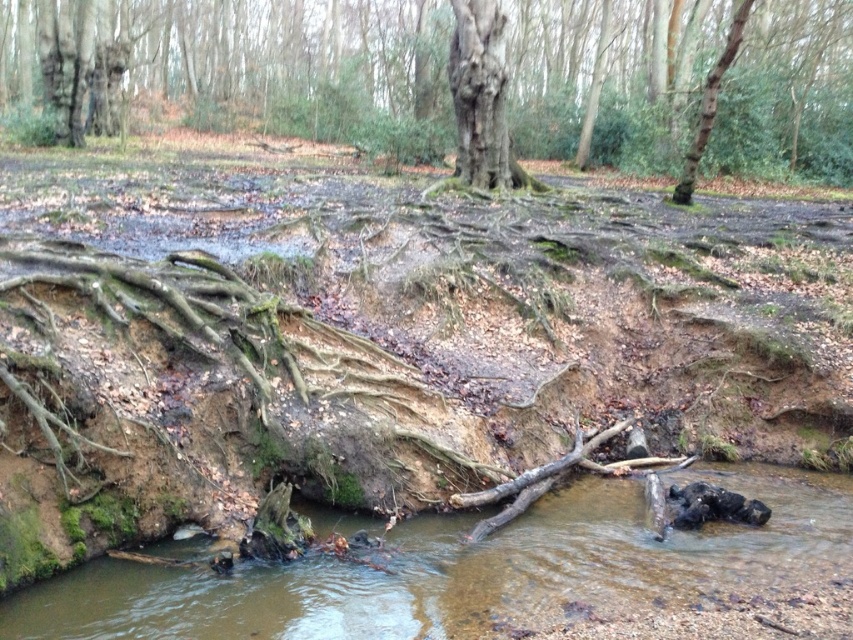
Does rough bark tree at center have a lesser width compared to brown rough bark tree trunk at upper right?

No.

Which is more to the right, rough bark tree at center or brown rough bark tree trunk at upper right?

From the viewer's perspective, brown rough bark tree trunk at upper right appears more on the right side.

Is point (314, 42) positioned before point (701, 141)?

No, (314, 42) is further to viewer.

I want to click on rough bark tree at center, so click(248, 68).

Is smooth bark tree trunk at center bigger than brown rough bark tree trunk at upper right?

No.

Is point (456, 164) less distant than point (706, 112)?

No, it is behind (706, 112).

Image resolution: width=853 pixels, height=640 pixels. In order to click on smooth bark tree trunk at center in this screenshot , I will do `click(479, 92)`.

Between point (364, 33) and point (488, 80), which one is positioned behind?

The point (364, 33) is behind.

Does rough bark tree at center have a larger size compared to smooth bark tree trunk at center?

Yes, rough bark tree at center is bigger than smooth bark tree trunk at center.

Between point (286, 72) and point (491, 84), which one is positioned in front?

Positioned in front is point (491, 84).

Where is `rough bark tree at center`? rough bark tree at center is located at coordinates (248, 68).